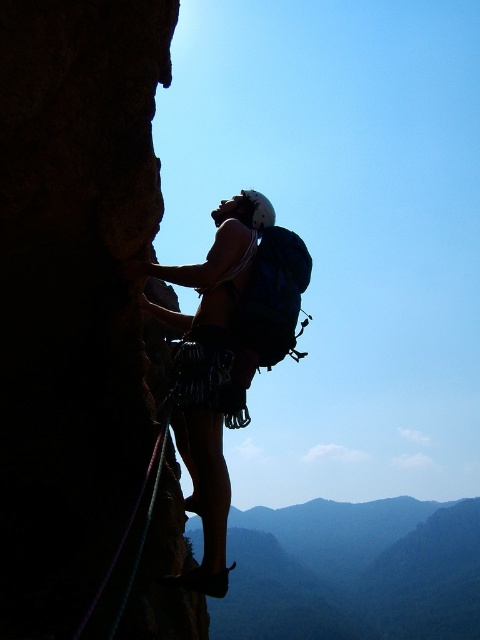
Does dark green textured mountain at lower center have a larger size compared to purple nylon rope at left?

Yes.

Does dark green textured mountain at lower center have a lesser width compared to purple nylon rope at left?

Incorrect, dark green textured mountain at lower center's width is not less than purple nylon rope at left's.

The image size is (480, 640). I want to click on dark green textured mountain at lower center, so click(x=352, y=572).